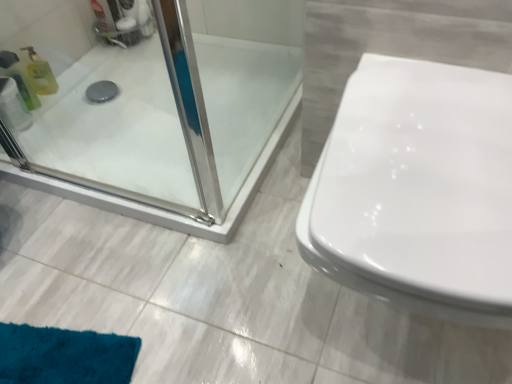
Locate an element on the screen. vacant space in front of translucent plastic bottle at left, which ranks as the first cleaning product in back-to-front order is located at coordinates (64, 118).